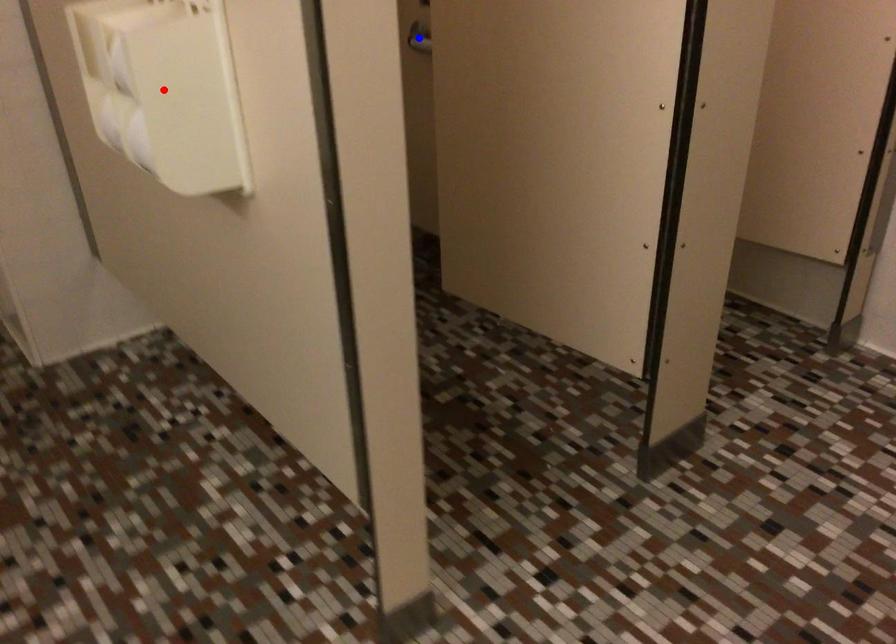
Question: Which of the two points in the image is closer to the camera?

Choices:
 (A) Blue point is closer.
 (B) Red point is closer.

Answer: (B)